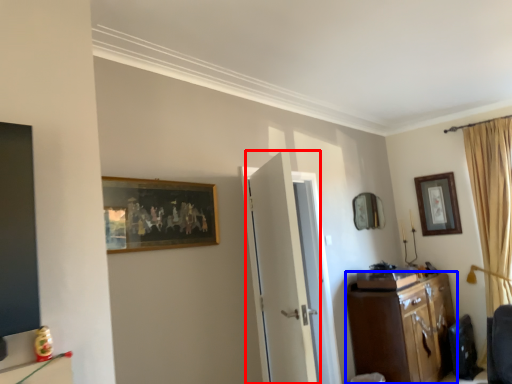
Question: Which object appears closest to the camera in this image, door (highlighted by a red box) or cabinetry (highlighted by a blue box)?

Choices:
 (A) door
 (B) cabinetry

Answer: (A)